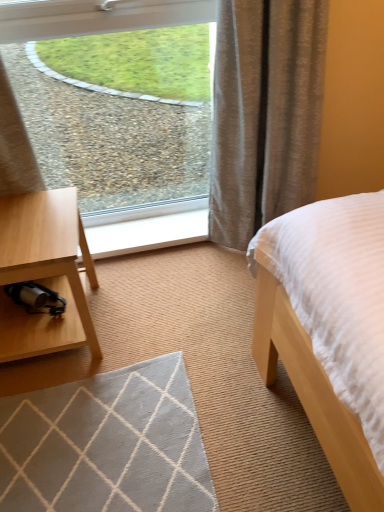
Question: Is textured beige curtain at upper right shorter than clear glass window at upper left?

Choices:
 (A) yes
 (B) no

Answer: (B)

Question: From the image's perspective, would you say textured beige curtain at upper right is shown under clear glass window at upper left?

Choices:
 (A) no
 (B) yes

Answer: (B)

Question: Is textured beige curtain at upper right smaller than clear glass window at upper left?

Choices:
 (A) yes
 (B) no

Answer: (B)

Question: Considering the relative sizes of textured beige curtain at upper right and clear glass window at upper left in the image provided, is textured beige curtain at upper right bigger than clear glass window at upper left?

Choices:
 (A) no
 (B) yes

Answer: (B)

Question: From the image's perspective, is textured beige curtain at upper right over clear glass window at upper left?

Choices:
 (A) no
 (B) yes

Answer: (A)

Question: Considering the relative positions of textured beige curtain at upper right and clear glass window at upper left in the image provided, is textured beige curtain at upper right to the left of clear glass window at upper left from the viewer's perspective?

Choices:
 (A) yes
 (B) no

Answer: (B)

Question: Can you confirm if clear glass window at upper left is thinner than textured beige curtain at upper right?

Choices:
 (A) yes
 (B) no

Answer: (A)

Question: From the image's perspective, does clear glass window at upper left appear lower than textured beige curtain at upper right?

Choices:
 (A) no
 (B) yes

Answer: (A)

Question: Can you confirm if clear glass window at upper left is shorter than textured beige curtain at upper right?

Choices:
 (A) no
 (B) yes

Answer: (B)

Question: Is clear glass window at upper left wider than textured beige curtain at upper right?

Choices:
 (A) no
 (B) yes

Answer: (A)

Question: Does clear glass window at upper left have a greater height compared to textured beige curtain at upper right?

Choices:
 (A) yes
 (B) no

Answer: (B)

Question: Is clear glass window at upper left looking in the opposite direction of textured beige curtain at upper right?

Choices:
 (A) yes
 (B) no

Answer: (B)

Question: Is textured beige curtain at upper right taller than white wood at center?

Choices:
 (A) yes
 (B) no

Answer: (A)